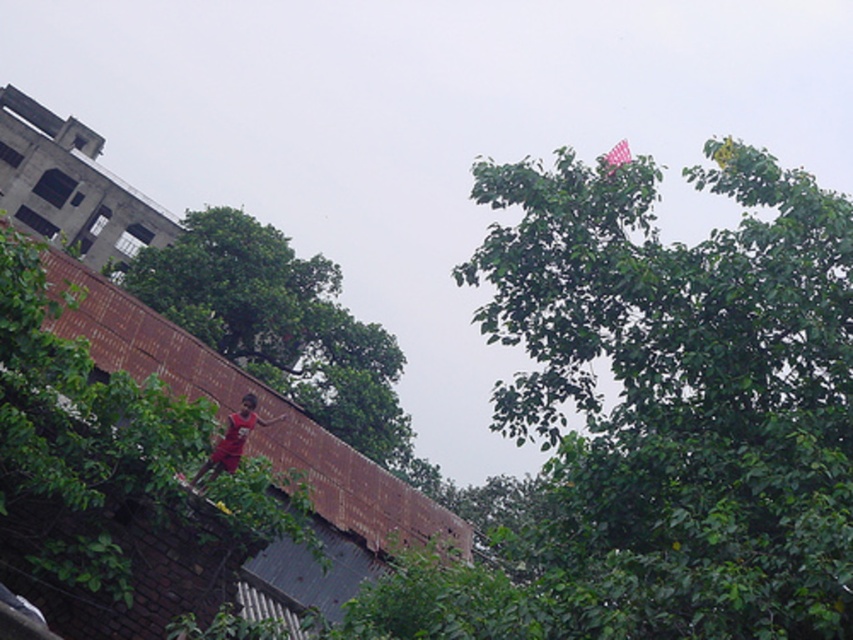
You are standing on the red brick wall and want to reach the green leafy tree at center. According to the coordinates provided, in which direction should you move to get closer to the tree?

The green leafy tree at center is located at coordinates point (277, 324). Since you are on the red brick wall, you should move towards the center of the image to reach the tree.

You are a photographer trying to capture a shot of the green leafy tree at upper right and the pink fabric kite at upper right. From your current position, which object is positioned to the left of the other?

The green leafy tree at upper right is to the left of the pink fabric kite at upper right.

You are a bird flying over the urban scene. You want to land on the green leafy tree at center and then move to the brown brick wall at upper left. Which direction should you fly first?

The green leafy tree at center is located below the brown brick wall at upper left, so you should fly upwards to reach the brown brick wall at upper left from the green leafy tree at center.